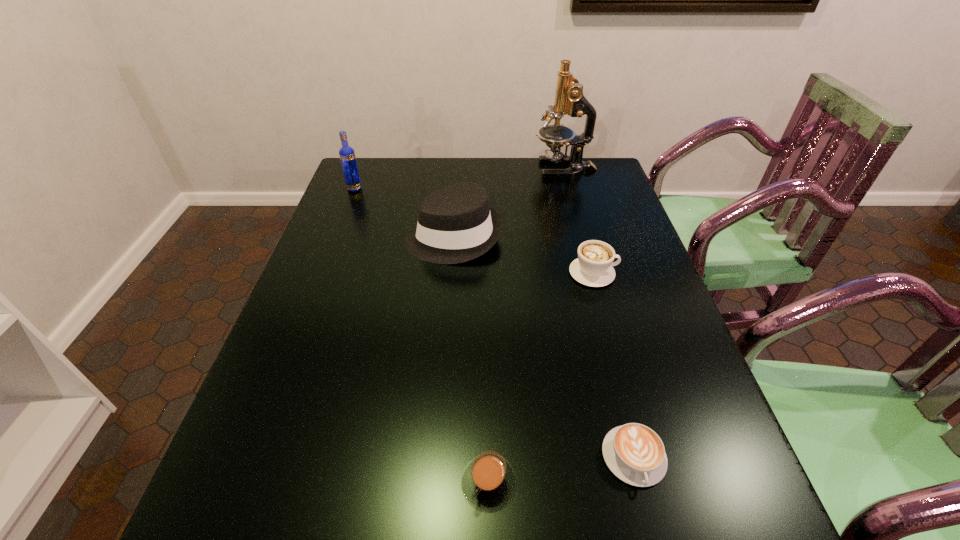
I want to click on microscope present at the right edge, so click(569, 98).

The width and height of the screenshot is (960, 540). Find the location of `object present at the far left corner`. object present at the far left corner is located at coordinates (347, 155).

This screenshot has height=540, width=960. In order to click on object at the far right corner in this screenshot , I will do `click(569, 98)`.

In the image, there is a desktop. Where is `free space at the far edge`? free space at the far edge is located at coordinates (511, 158).

Locate an element on the screen. This screenshot has width=960, height=540. vacant space at the left edge of the desktop is located at coordinates (370, 209).

Where is `vacant space at the right edge of the desktop`? The height and width of the screenshot is (540, 960). vacant space at the right edge of the desktop is located at coordinates (672, 376).

The height and width of the screenshot is (540, 960). What are the coordinates of `free point at the far left corner` in the screenshot? It's located at (378, 160).

This screenshot has width=960, height=540. What are the coordinates of `free space at the near left corner of the desktop` in the screenshot? It's located at tap(276, 535).

In order to click on free space between the fedora and the shortest object in this screenshot , I will do `click(544, 347)`.

I want to click on free space that is in between the shortest object and the leftmost object, so click(494, 323).